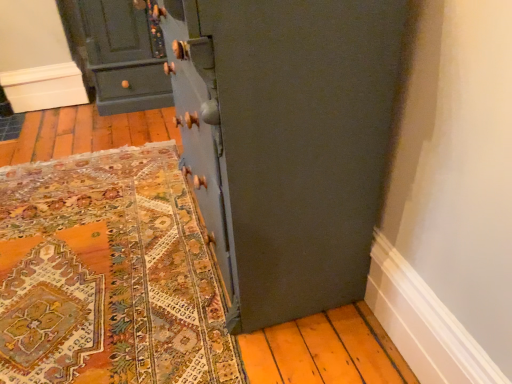
The width and height of the screenshot is (512, 384). Identify the location of matte dark green cabinet at upper left. (119, 54).

What do you see at coordinates (119, 54) in the screenshot? I see `matte dark green cabinet at upper left` at bounding box center [119, 54].

Measure the distance between point (298, 307) and camera.

Point (298, 307) and camera are 1.47 meters apart.

What do you see at coordinates (286, 141) in the screenshot? This screenshot has height=384, width=512. I see `matte blue cupboard at center` at bounding box center [286, 141].

Where is `matte blue cupboard at center`? matte blue cupboard at center is located at coordinates (286, 141).

In order to click on matte dark green cabinet at upper left in this screenshot , I will do `click(119, 54)`.

In the scene shown: Is matte blue cupboard at center to the left of matte dark green cabinet at upper left from the viewer's perspective?

In fact, matte blue cupboard at center is to the right of matte dark green cabinet at upper left.

In the image, is matte blue cupboard at center positioned in front of or behind matte dark green cabinet at upper left?

matte blue cupboard at center is positioned closer to the viewer than matte dark green cabinet at upper left.

Is point (178, 33) behind point (135, 67)?

No, it is not.

From the image's perspective, who appears lower, matte blue cupboard at center or matte dark green cabinet at upper left?

matte blue cupboard at center appears lower in the image.

From a real-world perspective, is matte blue cupboard at center positioned above or below matte dark green cabinet at upper left?

From a real-world perspective, matte blue cupboard at center is physically above matte dark green cabinet at upper left.

Can you confirm if matte blue cupboard at center is thinner than matte dark green cabinet at upper left?

Yes.

Considering the relative sizes of matte blue cupboard at center and matte dark green cabinet at upper left in the image provided, is matte blue cupboard at center shorter than matte dark green cabinet at upper left?

In fact, matte blue cupboard at center may be taller than matte dark green cabinet at upper left.

Between matte blue cupboard at center and matte dark green cabinet at upper left, which one has smaller size?

matte dark green cabinet at upper left is smaller.

Is matte blue cupboard at center inside the boundaries of matte dark green cabinet at upper left, or outside?

matte blue cupboard at center exists outside the volume of matte dark green cabinet at upper left.

Is matte blue cupboard at center in contact with matte dark green cabinet at upper left?

No.

Is matte blue cupboard at center turned away from matte dark green cabinet at upper left?

No, matte blue cupboard at center is not facing away from matte dark green cabinet at upper left.

What's the angular difference between matte blue cupboard at center and matte dark green cabinet at upper left's facing directions?

The angle between the facing direction of matte blue cupboard at center and the facing direction of matte dark green cabinet at upper left is 89.9 degrees.

Measure the distance from matte blue cupboard at center to matte dark green cabinet at upper left.

matte blue cupboard at center and matte dark green cabinet at upper left are 1.69 meters apart.

At what (x,y) coordinates should I click in order to perform the action: click on cupboard that appears above the matte dark green cabinet at upper left (from a real-world perspective). Please return your answer as a coordinate pair (x, y). Looking at the image, I should click on (286, 141).

Which object is positioned more to the left, matte dark green cabinet at upper left or matte blue cupboard at center?

matte dark green cabinet at upper left is more to the left.

Is matte dark green cabinet at upper left further to camera compared to matte blue cupboard at center?

Yes, it is behind matte blue cupboard at center.

Which point is more distant from viewer, (134, 85) or (376, 109)?

The point (134, 85) is behind.

From the image's perspective, which is above, matte dark green cabinet at upper left or matte blue cupboard at center?

From the image's view, matte dark green cabinet at upper left is above.

From a real-world perspective, who is located higher, matte dark green cabinet at upper left or matte blue cupboard at center?

matte blue cupboard at center, from a real-world perspective.

Is matte dark green cabinet at upper left thinner than matte blue cupboard at center?

No, matte dark green cabinet at upper left is not thinner than matte blue cupboard at center.

In the scene shown: Considering the sizes of objects matte dark green cabinet at upper left and matte blue cupboard at center in the image provided, who is taller, matte dark green cabinet at upper left or matte blue cupboard at center?

With more height is matte blue cupboard at center.

Based on the photo, looking at the image, does matte dark green cabinet at upper left seem bigger or smaller compared to matte blue cupboard at center?

Clearly, matte dark green cabinet at upper left is smaller in size than matte blue cupboard at center.

Is matte blue cupboard at center completely or partially inside matte dark green cabinet at upper left?

No, matte blue cupboard at center is located outside of matte dark green cabinet at upper left.

Is the surface of matte dark green cabinet at upper left in direct contact with matte blue cupboard at center?

No.

Looking at this image, is matte dark green cabinet at upper left oriented away from matte blue cupboard at center?

matte dark green cabinet at upper left does not have its back to matte blue cupboard at center.

Measure the distance from matte dark green cabinet at upper left to matte blue cupboard at center.

They are 1.69 meters apart.

The image size is (512, 384). What are the coordinates of `cupboard above the matte dark green cabinet at upper left (from a real-world perspective)` in the screenshot? It's located at (286, 141).

Find the location of `the chest of drawers below the matte blue cupboard at center (from a real-world perspective)`. the chest of drawers below the matte blue cupboard at center (from a real-world perspective) is located at coordinates (119, 54).

Find the location of a particular element. The image size is (512, 384). the chest of drawers behind the matte blue cupboard at center is located at coordinates (119, 54).